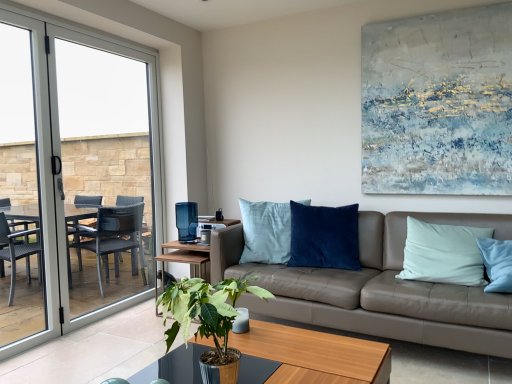
Find the location of a particular element. wooden coffee table at center is located at coordinates (314, 355).

Image resolution: width=512 pixels, height=384 pixels. Describe the element at coordinates (209, 320) in the screenshot. I see `green leafy plant at center` at that location.

What are the coordinates of `clear glass screen door at left` in the screenshot? It's located at (26, 189).

I want to click on leather couch at center, so click(x=380, y=289).

Measure the distance between point (179, 360) and camera.

The depth of point (179, 360) is 1.26 meters.

Where is `clear glass door at left`? clear glass door at left is located at coordinates (75, 175).

From a real-world perspective, is clear glass table at center positioned above or below textured canvas painting at upper right?

clear glass table at center is below textured canvas painting at upper right.

From the image's perspective, is clear glass table at center below textured canvas painting at upper right?

Yes, from the image's perspective, clear glass table at center is beneath textured canvas painting at upper right.

Is clear glass table at center far away from textured canvas painting at upper right?

Yes.

Can we say clear glass table at center lies outside textured canvas painting at upper right?

Yes.

Does green leafy plant at center have a greater width compared to clear glass table at center?

Incorrect, the width of green leafy plant at center does not surpass that of clear glass table at center.

Is green leafy plant at center to the left of clear glass table at center from the viewer's perspective?

No.

You are a GUI agent. You are given a task and a screenshot of the screen. Output one action in this format:
    pyautogui.click(x=<x>, y=<y>)
    Task: Click on the glass table that appears on the left of green leafy plant at center
    Image resolution: width=512 pixels, height=384 pixels.
    Given the screenshot: What is the action you would take?
    pyautogui.click(x=174, y=367)

From the image's perspective, is green leafy plant at center over clear glass table at center?

Yes, from the image's perspective, green leafy plant at center is over clear glass table at center.

Between wooden coffee table at center and green leafy plant at center, which one has larger size?

With larger size is wooden coffee table at center.

Is wooden coffee table at center taller than green leafy plant at center?

Incorrect, the height of wooden coffee table at center is not larger of that of green leafy plant at center.

Where is `houseplant located above the wooden coffee table at center (from the image's perspective)`? This screenshot has width=512, height=384. houseplant located above the wooden coffee table at center (from the image's perspective) is located at coordinates (209, 320).

From a real-world perspective, is wooden coffee table at center under clear glass screen door at left?

Yes.

Which of these two, wooden coffee table at center or clear glass screen door at left, stands taller?

With more height is clear glass screen door at left.

Between point (283, 355) and point (47, 200), which one is positioned in front?

The point (283, 355) is more forward.

Considering the relative positions of clear glass screen door at left and green leafy plant at center in the image provided, is clear glass screen door at left behind green leafy plant at center?

Yes, the depth of clear glass screen door at left is greater than that of green leafy plant at center.

Between clear glass screen door at left and green leafy plant at center, which one appears on the left side from the viewer's perspective?

Positioned to the left is clear glass screen door at left.

From the image's perspective, would you say clear glass screen door at left is positioned over green leafy plant at center?

Correct, clear glass screen door at left appears higher than green leafy plant at center in the image.

Does clear glass screen door at left turn towards green leafy plant at center?

No.

Is green leafy plant at center bigger or smaller than clear glass screen door at left?

green leafy plant at center is smaller than clear glass screen door at left.

Is green leafy plant at center outside of clear glass screen door at left?

That's correct, green leafy plant at center is outside of clear glass screen door at left.

In the scene shown: Does green leafy plant at center have a lesser width compared to clear glass screen door at left?

In fact, green leafy plant at center might be wider than clear glass screen door at left.

Considering the sizes of clear glass door at left and textured canvas painting at upper right in the image, is clear glass door at left taller or shorter than textured canvas painting at upper right?

Clearly, clear glass door at left is taller compared to textured canvas painting at upper right.

Would you say clear glass door at left is inside or outside textured canvas painting at upper right?

clear glass door at left is outside textured canvas painting at upper right.

Considering the relative sizes of clear glass door at left and textured canvas painting at upper right in the image provided, is clear glass door at left smaller than textured canvas painting at upper right?

Actually, clear glass door at left might be larger than textured canvas painting at upper right.

Is point (77, 272) closer or farther from the camera than point (446, 180)?

Point (77, 272) is farther from the camera than point (446, 180).

In order to click on glass table lying on the left of textured canvas painting at upper right in this screenshot , I will do `click(174, 367)`.

The width and height of the screenshot is (512, 384). I want to click on houseplant above the clear glass table at center (from the image's perspective), so click(x=209, y=320).

Based on their spatial positions, is clear glass screen door at left or green leafy plant at center closer to textured canvas painting at upper right?

green leafy plant at center lies closer to textured canvas painting at upper right than the other object.

Based on their spatial positions, is clear glass screen door at left or textured canvas painting at upper right closer to green leafy plant at center?

clear glass screen door at left.

Considering their positions, is textured canvas painting at upper right positioned further to leather couch at center than wooden coffee table at center?

textured canvas painting at upper right is further to leather couch at center.

Estimate the real-world distances between objects in this image. Which object is closer to clear glass door at left, clear glass screen door at left or green leafy plant at center?

Based on the image, clear glass screen door at left appears to be nearer to clear glass door at left.

When comparing their distances from green leafy plant at center, does textured canvas painting at upper right or clear glass screen door at left seem further?

Among the two, textured canvas painting at upper right is located further to green leafy plant at center.

Based on the photo, when comparing their distances from clear glass screen door at left, does textured canvas painting at upper right or leather couch at center seem further?

The object further to clear glass screen door at left is textured canvas painting at upper right.

Considering their positions, is green leafy plant at center positioned further to leather couch at center than textured canvas painting at upper right?

Based on the image, textured canvas painting at upper right appears to be further to leather couch at center.

When comparing their distances from leather couch at center, does clear glass screen door at left or clear glass table at center seem closer?

clear glass table at center.

Identify the location of coffee table located between green leafy plant at center and textured canvas painting at upper right in the depth direction. (314, 355).

Image resolution: width=512 pixels, height=384 pixels. In order to click on screen door between clear glass table at center and clear glass door at left in the front-back direction in this screenshot , I will do `click(26, 189)`.

Locate an element on the screen. This screenshot has width=512, height=384. houseplant between clear glass table at center and leather couch at center in the horizontal direction is located at coordinates (209, 320).

This screenshot has height=384, width=512. Identify the location of glass table between clear glass screen door at left and textured canvas painting at upper right. (174, 367).